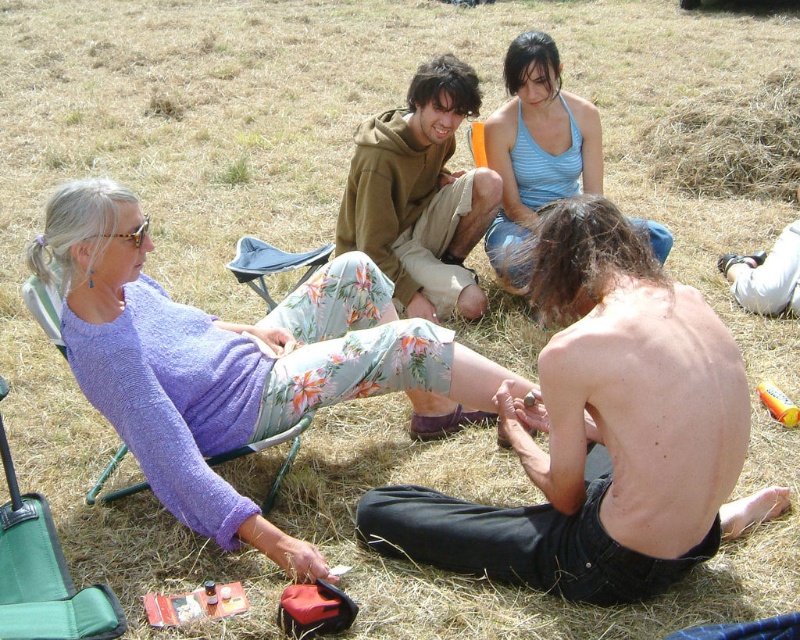
Question: Estimate the real-world distances between objects in this image. Which object is farther from the green fabric chair at lower left?

Choices:
 (A) brown dry grass at upper right
 (B) shiny black skin at lower right

Answer: (A)

Question: Does brown dry grass at upper right have a greater width compared to green fabric chair at lower left?

Choices:
 (A) no
 (B) yes

Answer: (B)

Question: Is brown cotton hoodie at center wider than blue striped tank top at upper center?

Choices:
 (A) no
 (B) yes

Answer: (B)

Question: Which point is farther to the camera?

Choices:
 (A) green fabric chair at lower left
 (B) green fabric folding chair at lower left

Answer: (A)

Question: Does shiny black skin at lower right have a lesser width compared to brown dry grass at upper right?

Choices:
 (A) yes
 (B) no

Answer: (A)

Question: Which of these objects is positioned farthest from the green fabric chair at lower left?

Choices:
 (A) purple knit sweater at upper left
 (B) green fabric folding chair at lower left

Answer: (B)